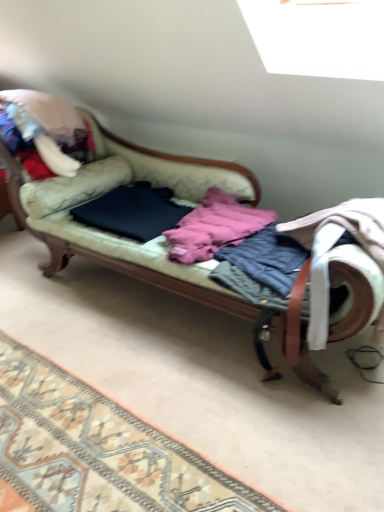
Identify the location of vacant area located to the right-hand side of patterned carpet at lower left. (256, 412).